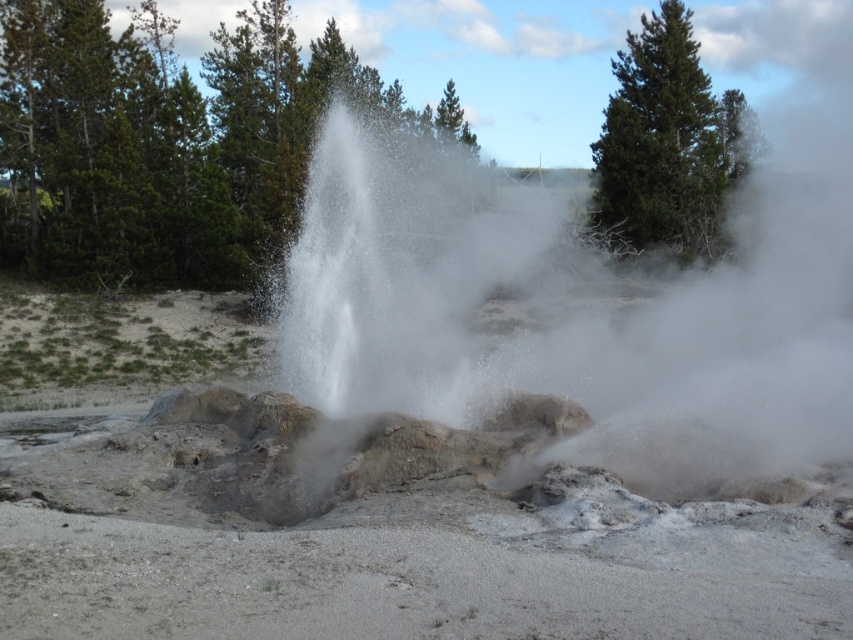
Who is positioned more to the left, white dusty steam at center or green matte pine at upper right?

From the viewer's perspective, white dusty steam at center appears more on the left side.

Looking at this image, between white dusty steam at center and green matte pine at upper right, which one is positioned lower?

white dusty steam at center is below.

Which is in front, point (724, 448) or point (602, 161)?

Point (724, 448)

Find the location of a particular element. The image size is (853, 640). white dusty steam at center is located at coordinates (573, 316).